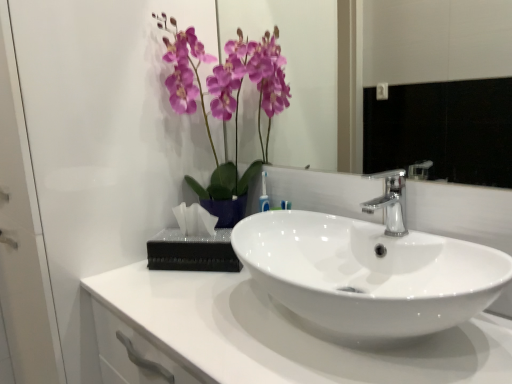
Locate an element on the screen. vacant space that is in between white glossy sink at center and translucent plastic tissue at center is located at coordinates (195, 281).